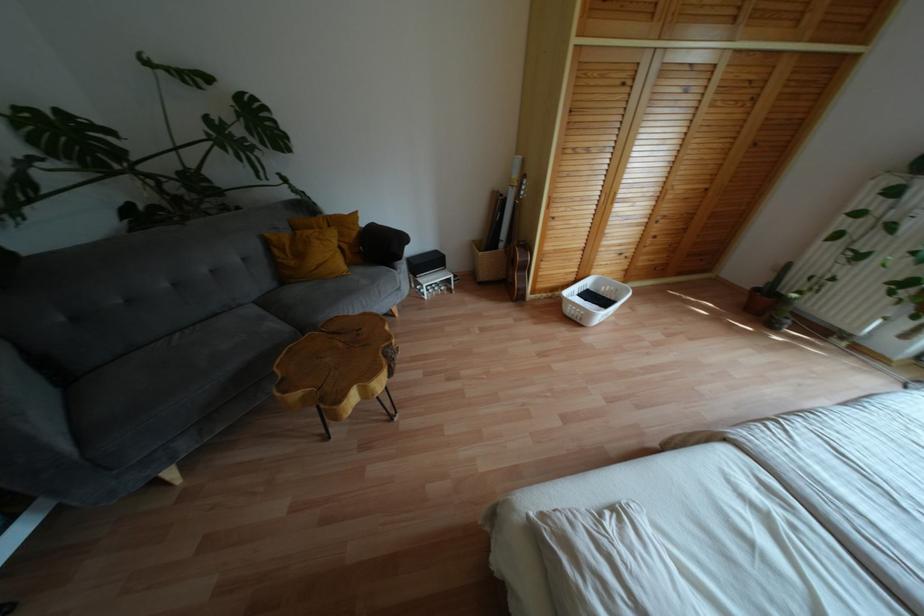
This screenshot has width=924, height=616. What do you see at coordinates (200, 355) in the screenshot?
I see `the sofa sitting surface` at bounding box center [200, 355].